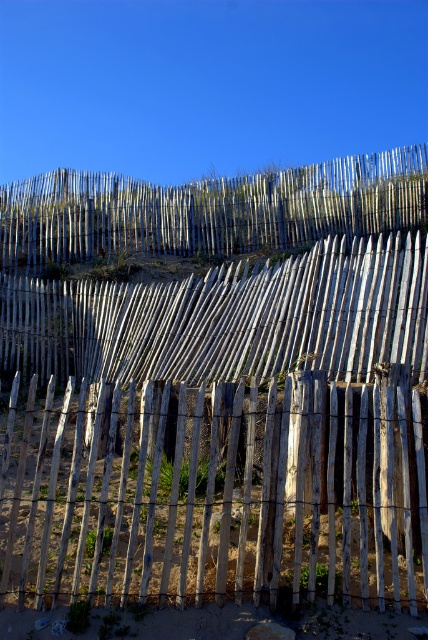
Which is more to the right, weathered wood fence at center or weathered wood fence at upper center?

weathered wood fence at center

This screenshot has width=428, height=640. Describe the element at coordinates (222, 388) in the screenshot. I see `weathered wood fence at center` at that location.

Is point (351, 257) positioned before point (181, 237)?

Yes, point (351, 257) is closer to viewer.

I want to click on weathered wood fence at center, so click(222, 388).